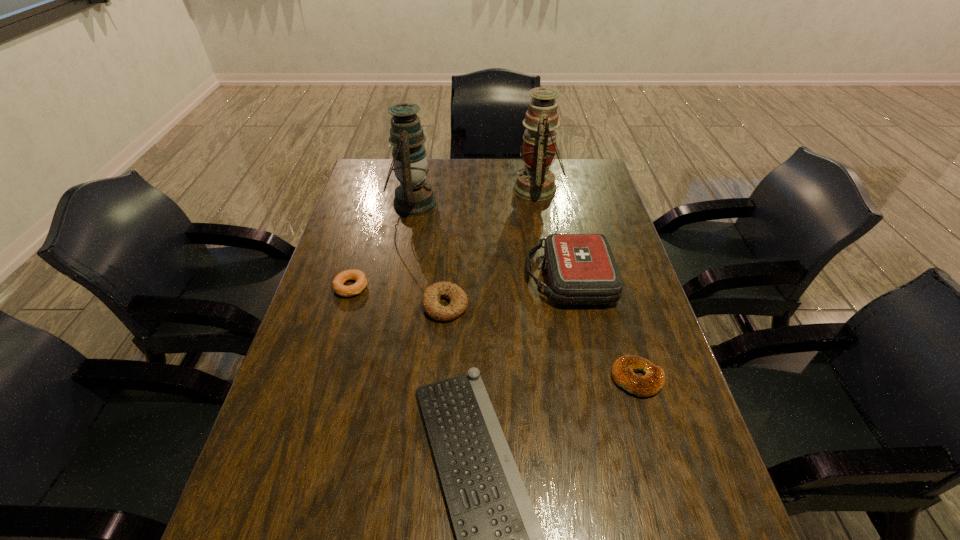
Find the location of a particular element. This screenshot has width=960, height=540. free region located 0.390m on the back of the rightmost bagel is located at coordinates (600, 254).

I want to click on blank space located on the front of the leftmost bagel, so click(312, 416).

The image size is (960, 540). I want to click on oil lamp that is positioned at the left edge, so click(413, 197).

Locate an element on the screen. bagel situated at the left edge is located at coordinates [361, 281].

Locate an element on the screen. The image size is (960, 540). oil lamp at the right edge is located at coordinates (535, 182).

I want to click on the first-aid kit that is at the right edge, so coord(581,268).

Where is `bagel that is positioned at the right edge`? bagel that is positioned at the right edge is located at coordinates click(623, 369).

Locate an element on the screen. This screenshot has height=540, width=960. object that is positioned at the far left corner is located at coordinates (413, 197).

The height and width of the screenshot is (540, 960). In order to click on object at the far right corner in this screenshot , I will do (x=535, y=182).

Image resolution: width=960 pixels, height=540 pixels. In order to click on free space at the far edge in this screenshot , I will do `click(453, 181)`.